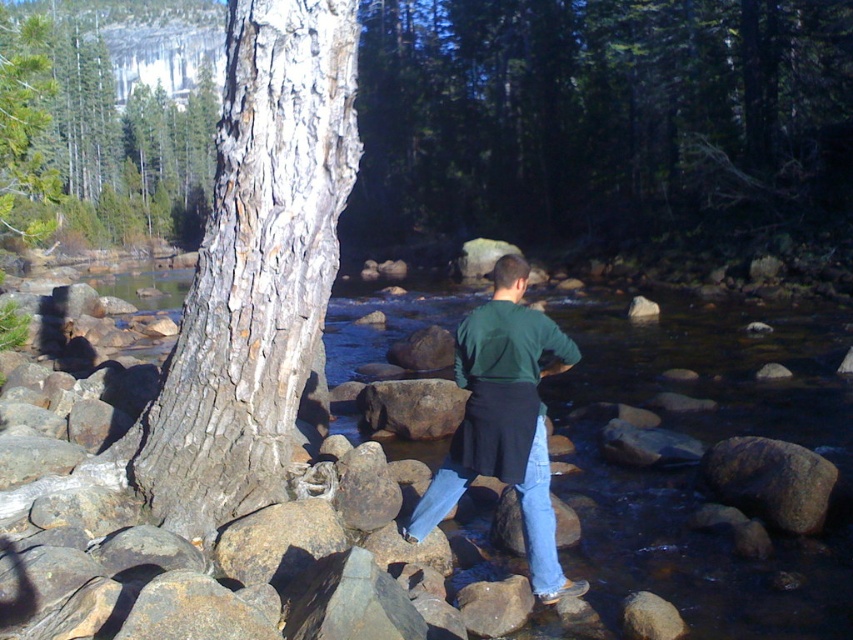
Who is more forward, (833, 49) or (521, 352)?

Point (521, 352)

Measure the distance between smooth bark tree at center and camera.

5.73 meters

Is point (393, 100) more distant than point (514, 336)?

Yes, point (393, 100) is farther from viewer.

This screenshot has width=853, height=640. I want to click on smooth bark tree at center, so click(x=604, y=120).

Does smooth bark tree at center lie behind smooth bark tree at upper left?

No.

Is point (434, 131) in front of point (22, 81)?

No.

You are a GUI agent. You are given a task and a screenshot of the screen. Output one action in this format:
    pyautogui.click(x=<x>, y=<y>)
    Task: Click on the smooth bark tree at center
    Image resolution: width=853 pixels, height=640 pixels.
    Given the screenshot: What is the action you would take?
    pyautogui.click(x=604, y=120)

What do you see at coordinates (254, 268) in the screenshot?
I see `grayish-brown bark tree trunk at left` at bounding box center [254, 268].

Between point (287, 394) and point (831, 484), which one is positioned in front?

Positioned in front is point (287, 394).

Locate an element on the screen. grayish-brown bark tree trunk at left is located at coordinates (254, 268).